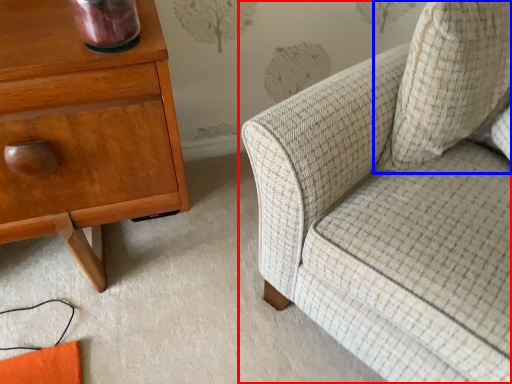
Question: Which of the following is the closest to the observer, chair (highlighted by a red box) or throw pillow (highlighted by a blue box)?

Choices:
 (A) chair
 (B) throw pillow

Answer: (A)